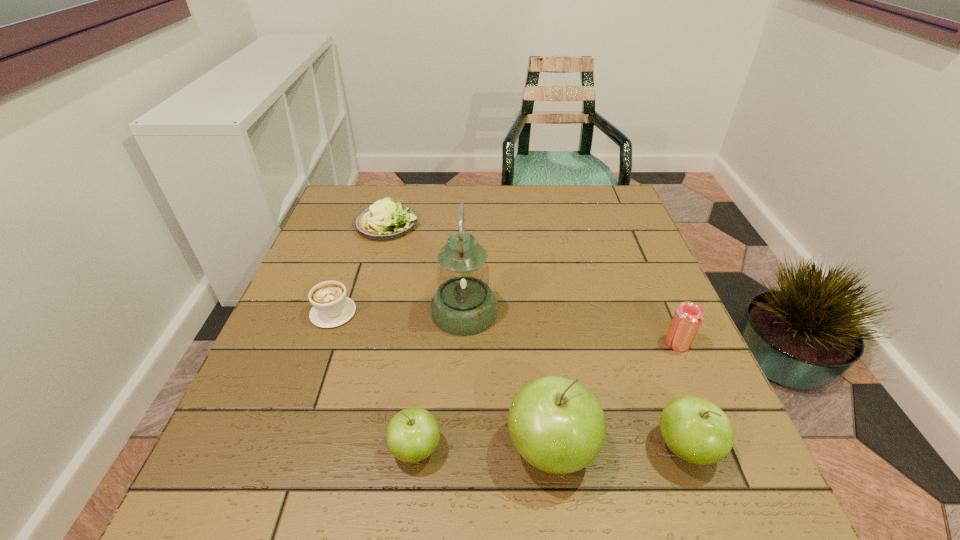
What are the coordinates of `cappuccino located at the left edge` in the screenshot? It's located at 331,308.

The image size is (960, 540). Find the location of `apple located in the right edge section of the desktop`. apple located in the right edge section of the desktop is located at coordinates (696, 430).

Identify the location of beer can present at the right edge. This screenshot has height=540, width=960. point(687,319).

Where is `object at the far left corner`? object at the far left corner is located at coordinates (384, 220).

Locate an element on the screen. The height and width of the screenshot is (540, 960). object present at the near right corner is located at coordinates (696, 430).

This screenshot has height=540, width=960. In order to click on free spot at the far edge of the desktop in this screenshot , I will do `click(578, 225)`.

Where is `vacant space at the near edge`? The width and height of the screenshot is (960, 540). vacant space at the near edge is located at coordinates pyautogui.click(x=336, y=436).

The width and height of the screenshot is (960, 540). I want to click on free space at the left edge, so click(338, 355).

Find the location of a particular element. free space at the right edge of the desktop is located at coordinates (603, 242).

The width and height of the screenshot is (960, 540). In the image, there is a desktop. Find the location of `vacant space at the far left corner`. vacant space at the far left corner is located at coordinates (341, 207).